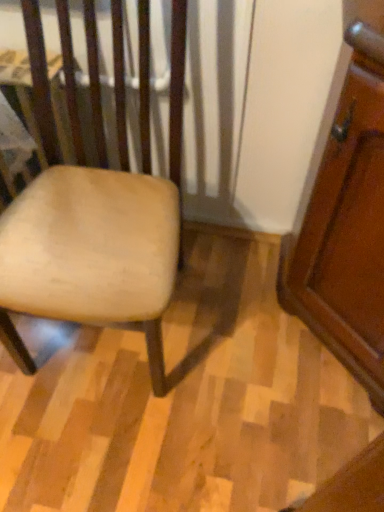
Locate an element on the screen. wooden screen door at right is located at coordinates (345, 236).

Image resolution: width=384 pixels, height=512 pixels. What do you see at coordinates (345, 236) in the screenshot? I see `wooden screen door at right` at bounding box center [345, 236].

This screenshot has height=512, width=384. What are the coordinates of `light brown wood chair at left` in the screenshot? It's located at (101, 225).

Image resolution: width=384 pixels, height=512 pixels. What do you see at coordinates (101, 225) in the screenshot?
I see `light brown wood chair at left` at bounding box center [101, 225].

At what (x,y) coordinates should I click in order to perform the action: click on wooden screen door at right. Please return your answer as a coordinate pair (x, y). Looking at the image, I should click on (345, 236).

Is wooden screen door at right to the left or to the right of light brown wood chair at left in the image?

wooden screen door at right is to the right of light brown wood chair at left.

Based on the photo, which object is closer to the camera, wooden screen door at right or light brown wood chair at left?

light brown wood chair at left is closer to the camera.

Between point (356, 95) and point (146, 214), which one is positioned behind?

Positioned behind is point (146, 214).

From the image's perspective, is wooden screen door at right below light brown wood chair at left?

Indeed, from the image's perspective, wooden screen door at right is shown beneath light brown wood chair at left.

From a real-world perspective, is wooden screen door at right over light brown wood chair at left?

No, from a real-world perspective, wooden screen door at right is not over light brown wood chair at left

Considering the relative sizes of wooden screen door at right and light brown wood chair at left in the image provided, is wooden screen door at right wider than light brown wood chair at left?

No.

Based on the photo, considering the sizes of objects wooden screen door at right and light brown wood chair at left in the image provided, who is shorter, wooden screen door at right or light brown wood chair at left?

Standing shorter between the two is wooden screen door at right.

Considering the sizes of objects wooden screen door at right and light brown wood chair at left in the image provided, who is bigger, wooden screen door at right or light brown wood chair at left?

With larger size is light brown wood chair at left.

Consider the image. Is wooden screen door at right inside or outside of light brown wood chair at left?

wooden screen door at right is not enclosed by light brown wood chair at left.

Does wooden screen door at right touch light brown wood chair at left?

No, wooden screen door at right is not beside light brown wood chair at left.

Is wooden screen door at right turned away from light brown wood chair at left?

No.

How many degrees apart are the facing directions of wooden screen door at right and light brown wood chair at left?

The angle between the facing direction of wooden screen door at right and the facing direction of light brown wood chair at left is 51 degrees.

Measure the distance between wooden screen door at right and light brown wood chair at left.

19.27 inches.

Image resolution: width=384 pixels, height=512 pixels. I want to click on chair in front of the wooden screen door at right, so click(x=101, y=225).

Considering the positions of objects light brown wood chair at left and wooden screen door at right in the image provided, who is more to the right, light brown wood chair at left or wooden screen door at right?

wooden screen door at right is more to the right.

Between light brown wood chair at left and wooden screen door at right, which one is positioned behind?

wooden screen door at right is behind.

Is point (23, 0) closer or farther from the camera than point (376, 261)?

Point (23, 0) is farther from the camera than point (376, 261).

Based on the photo, from the image's perspective, relative to wooden screen door at right, is light brown wood chair at left above or below?

From the image's perspective, light brown wood chair at left appears above wooden screen door at right.

From a real-world perspective, which object rests below the other?

wooden screen door at right is physically lower.

Considering the sizes of objects light brown wood chair at left and wooden screen door at right in the image provided, who is wider, light brown wood chair at left or wooden screen door at right?

With larger width is light brown wood chair at left.

Is light brown wood chair at left shorter than wooden screen door at right?

Incorrect, the height of light brown wood chair at left does not fall short of that of wooden screen door at right.

Which of these two, light brown wood chair at left or wooden screen door at right, is bigger?

light brown wood chair at left.

Would you say light brown wood chair at left is inside or outside wooden screen door at right?

light brown wood chair at left is not inside wooden screen door at right, it's outside.

Is light brown wood chair at left directly adjacent to wooden screen door at right?

light brown wood chair at left and wooden screen door at right are not in contact.

Is light brown wood chair at left aimed at wooden screen door at right?

No, light brown wood chair at left is not oriented towards wooden screen door at right.

Find the location of a particular element. The width and height of the screenshot is (384, 512). chair in front of the wooden screen door at right is located at coordinates (101, 225).

Find the location of `screen door on the right side of light brown wood chair at left`. screen door on the right side of light brown wood chair at left is located at coordinates click(x=345, y=236).

The width and height of the screenshot is (384, 512). I want to click on chair that is in front of the wooden screen door at right, so click(101, 225).